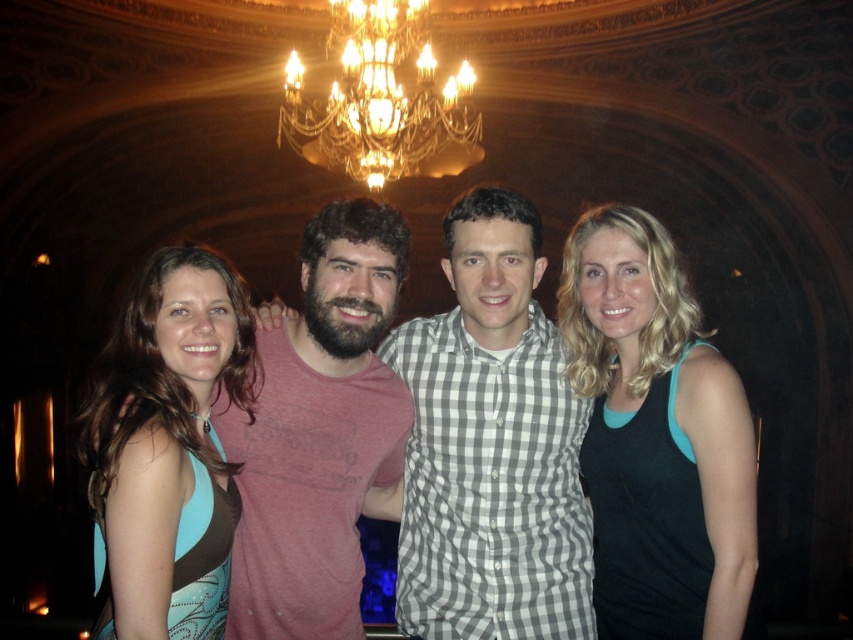
Does checkered fabric shirt at center appear under black matte tank top at right?

Incorrect, checkered fabric shirt at center is not positioned below black matte tank top at right.

Is the position of checkered fabric shirt at center more distant than that of black matte tank top at right?

That is True.

Which is in front, point (534, 451) or point (715, 525)?

Point (715, 525) is in front.

Identify the location of checkered fabric shirt at center. The width and height of the screenshot is (853, 640). coord(491,445).

Is point (662, 595) closer to viewer compared to point (395, 38)?

Yes, it is in front of point (395, 38).

Where is `black matte tank top at right`? This screenshot has width=853, height=640. black matte tank top at right is located at coordinates (656, 436).

At what (x,y) coordinates should I click in order to perform the action: click on black matte tank top at right. Please return your answer as a coordinate pair (x, y). This screenshot has height=640, width=853. Looking at the image, I should click on (656, 436).

The image size is (853, 640). What do you see at coordinates (320, 433) in the screenshot? I see `matte red t-shirt at center` at bounding box center [320, 433].

Between matte red t-shirt at center and blue fabric dress at left, which one is positioned higher?

matte red t-shirt at center is above.

I want to click on matte red t-shirt at center, so click(320, 433).